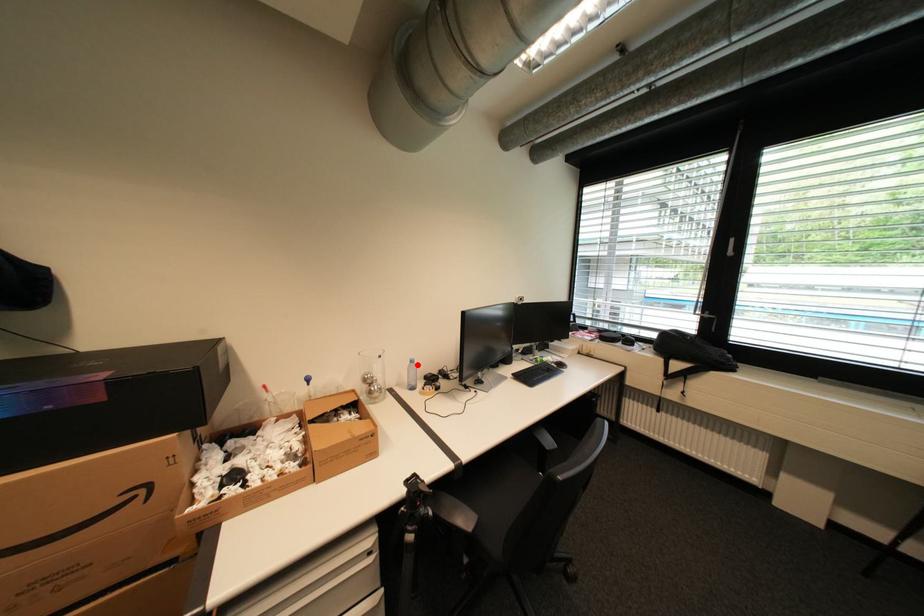
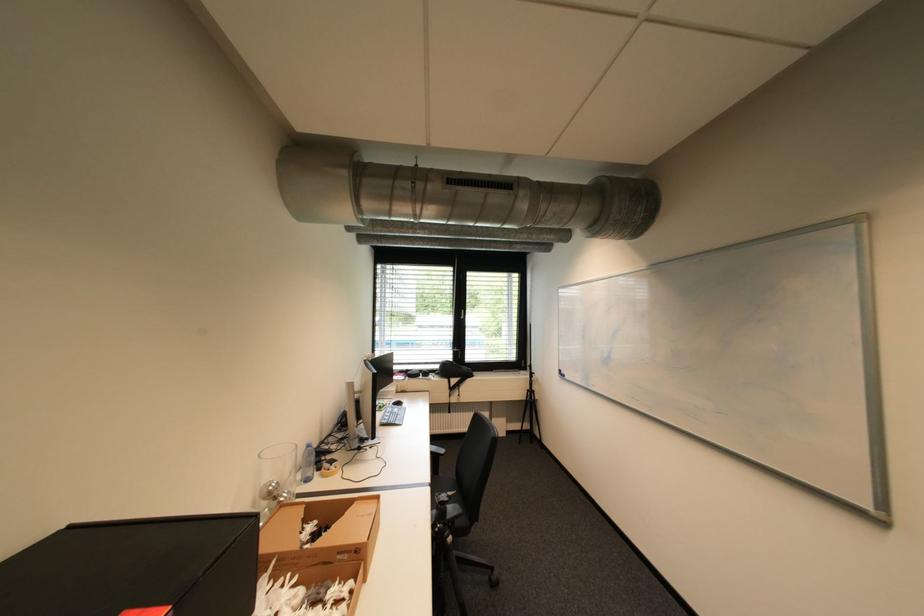
Locate, in the second image, the point that corresponds to the highlighted location in the first image.

(313, 451)